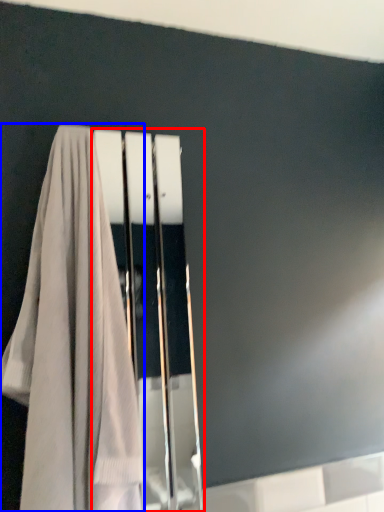
Question: Which object appears farthest to the camera in this image, screen door (highlighted by a red box) or towel (highlighted by a blue box)?

Choices:
 (A) screen door
 (B) towel

Answer: (A)